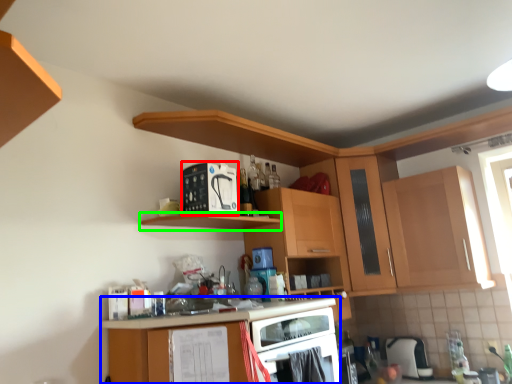
Question: Which is nearer to the appliance (highlighted by a red box)? cabinetry (highlighted by a blue box) or shelf (highlighted by a green box).

Choices:
 (A) cabinetry
 (B) shelf

Answer: (B)